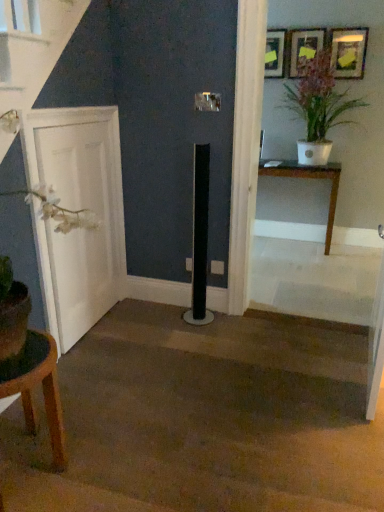
Question: Would you say matte black picture frame at upper center, which appears as the third picture frame when viewed from the right, is to the left or to the right of brown wooden table at lower left, acting as the 1th table starting from the left, in the picture?

Choices:
 (A) left
 (B) right

Answer: (B)

Question: In terms of size, does matte black picture frame at upper center, the first picture frame when ordered from left to right, appear bigger or smaller than brown wooden table at lower left, the second table positioned from the back?

Choices:
 (A) small
 (B) big

Answer: (A)

Question: Which object is the farthest from the wooden picture frame at upper center, which ranks as the 2th picture frame in right-to-left order?

Choices:
 (A) matte black picture frame at upper center, the first picture frame when ordered from left to right
 (B) brown wooden table at lower left, the second table positioned from the top
 (C) white matte door at left
 (D) wooden table at right, positioned as the 2th table in bottom-to-top order
 (E) white glossy pot at upper right

Answer: (B)

Question: Considering the real-world distances, which object is farthest from the white matte door at left?

Choices:
 (A) matte black picture frame at upper center, the first picture frame when ordered from left to right
 (B) wooden table at right, the second table positioned from the left
 (C) white glossy pot at upper right
 (D) matte black picture frame at upper right, the third picture frame positioned from the left
 (E) brown wooden table at lower left, the second table positioned from the back

Answer: (D)